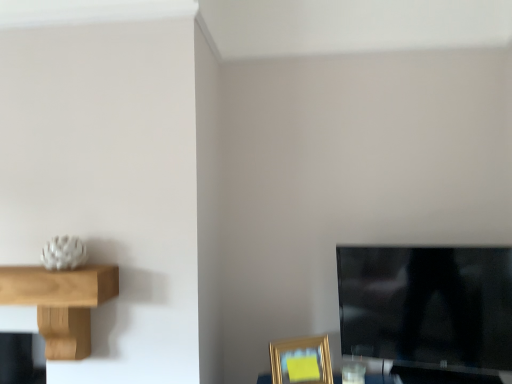
Image resolution: width=512 pixels, height=384 pixels. I want to click on gold metallic picture frame at lower right, so click(301, 361).

Image resolution: width=512 pixels, height=384 pixels. Describe the element at coordinates (61, 302) in the screenshot. I see `light brown wooden shelf at left` at that location.

The height and width of the screenshot is (384, 512). I want to click on gold metallic picture frame at lower right, so click(x=301, y=361).

Is light brown wooden shelf at left positioned with its back to gold metallic picture frame at lower right?

No, light brown wooden shelf at left is not facing away from gold metallic picture frame at lower right.

Where is `picture frame on the right of light brown wooden shelf at left`? The width and height of the screenshot is (512, 384). picture frame on the right of light brown wooden shelf at left is located at coordinates (301, 361).

How many degrees apart are the facing directions of light brown wooden shelf at left and gold metallic picture frame at lower right?

27.8 degrees separate the facing orientations of light brown wooden shelf at left and gold metallic picture frame at lower right.

The width and height of the screenshot is (512, 384). I want to click on picture frame located behind the black glossy tv at lower right, so click(301, 361).

Does point (327, 370) appear closer or farther from the camera than point (445, 381)?

Point (327, 370) is positioned farther from the camera compared to point (445, 381).

Would you consider gold metallic picture frame at lower right to be distant from black glossy tv at lower right?

No, gold metallic picture frame at lower right is not far from black glossy tv at lower right.

Which point is more forward, (414, 276) or (278, 363)?

The point (278, 363) is more forward.

Find the location of `television on the right of gold metallic picture frame at lower right`. television on the right of gold metallic picture frame at lower right is located at coordinates (428, 312).

Could you tell me if black glossy tv at lower right is turned towards gold metallic picture frame at lower right?

No, black glossy tv at lower right is not aimed at gold metallic picture frame at lower right.

Can you tell me how much black glossy tv at lower right and gold metallic picture frame at lower right differ in facing direction?

The angle between the facing direction of black glossy tv at lower right and the facing direction of gold metallic picture frame at lower right is 43.1 degrees.

Identify the location of shelf above the gold metallic picture frame at lower right (from the image's perspective). (61, 302).

In terms of width, does gold metallic picture frame at lower right look wider or thinner when compared to light brown wooden shelf at left?

gold metallic picture frame at lower right is thinner than light brown wooden shelf at left.

From a real-world perspective, is gold metallic picture frame at lower right below light brown wooden shelf at left?

Indeed, from a real-world perspective, gold metallic picture frame at lower right is positioned beneath light brown wooden shelf at left.

Is light brown wooden shelf at left shorter than black glossy tv at lower right?

Yes, light brown wooden shelf at left is shorter than black glossy tv at lower right.

Is light brown wooden shelf at left bigger than black glossy tv at lower right?

Indeed, light brown wooden shelf at left has a larger size compared to black glossy tv at lower right.

Is light brown wooden shelf at left beside black glossy tv at lower right?

No, light brown wooden shelf at left is not in contact with black glossy tv at lower right.

Is light brown wooden shelf at left at the right side of black glossy tv at lower right?

No, light brown wooden shelf at left is not to the right of black glossy tv at lower right.

Does black glossy tv at lower right have a larger size compared to light brown wooden shelf at left?

Incorrect, black glossy tv at lower right is not larger than light brown wooden shelf at left.

Does point (401, 289) come behind point (117, 276)?

Yes, point (401, 289) is behind point (117, 276).

Does black glossy tv at lower right have a lesser height compared to light brown wooden shelf at left?

No, black glossy tv at lower right is not shorter than light brown wooden shelf at left.

From the image's perspective, who appears lower, black glossy tv at lower right or light brown wooden shelf at left?

black glossy tv at lower right.

You are a GUI agent. You are given a task and a screenshot of the screen. Output one action in this format:
    pyautogui.click(x=<x>, y=<y>)
    Task: Click on the shelf on the left of gold metallic picture frame at lower right
    The width and height of the screenshot is (512, 384).
    Given the screenshot: What is the action you would take?
    pyautogui.click(x=61, y=302)

I want to click on television on the right of gold metallic picture frame at lower right, so click(x=428, y=312).

Estimate the real-world distances between objects in this image. Which object is closer to black glossy tv at lower right, light brown wooden shelf at left or gold metallic picture frame at lower right?

Based on the image, gold metallic picture frame at lower right appears to be nearer to black glossy tv at lower right.

Estimate the real-world distances between objects in this image. Which object is closer to light brown wooden shelf at left, gold metallic picture frame at lower right or black glossy tv at lower right?

gold metallic picture frame at lower right is closer to light brown wooden shelf at left.

Considering their positions, is light brown wooden shelf at left positioned closer to gold metallic picture frame at lower right than black glossy tv at lower right?

black glossy tv at lower right is positioned closer to the anchor gold metallic picture frame at lower right.

Based on their spatial positions, is black glossy tv at lower right or gold metallic picture frame at lower right further from light brown wooden shelf at left?

black glossy tv at lower right.

Considering their positions, is black glossy tv at lower right positioned closer to gold metallic picture frame at lower right than light brown wooden shelf at left?

black glossy tv at lower right is closer to gold metallic picture frame at lower right.

Considering their positions, is gold metallic picture frame at lower right positioned further to black glossy tv at lower right than light brown wooden shelf at left?

The object further to black glossy tv at lower right is light brown wooden shelf at left.

The height and width of the screenshot is (384, 512). In order to click on picture frame between light brown wooden shelf at left and black glossy tv at lower right in the horizontal direction in this screenshot , I will do [301, 361].